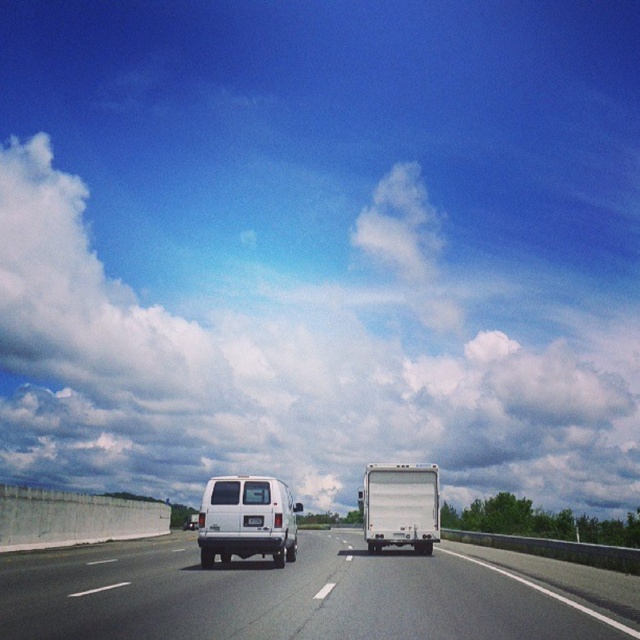
Between point (273, 502) and point (396, 516), which one is positioned in front?

Positioned in front is point (273, 502).

Does white matte van at center have a larger size compared to white matte truck at center?

Actually, white matte van at center might be smaller than white matte truck at center.

Between point (211, 496) and point (410, 522), which one is positioned behind?

The point (410, 522) is more distant.

This screenshot has width=640, height=640. I want to click on white matte van at center, so click(243, 518).

Does white glossy van at center have a lesser width compared to white matte truck at center?

In fact, white glossy van at center might be wider than white matte truck at center.

Does point (596, 637) come behind point (371, 468)?

No, it is not.

Which is in front, point (532, 634) or point (433, 518)?

Point (532, 634)

Where is `white glossy van at center`? The height and width of the screenshot is (640, 640). white glossy van at center is located at coordinates [284, 596].

In the scene shown: Which is more to the right, white fluffy cloud at upper center or white matte truck at center?

white matte truck at center is more to the right.

Describe the element at coordinates (301, 364) in the screenshot. This screenshot has height=640, width=640. I see `white fluffy cloud at upper center` at that location.

Does point (154, 355) come closer to viewer compared to point (392, 541)?

No, it is not.

Identify the location of white fluffy cloud at upper center. (301, 364).